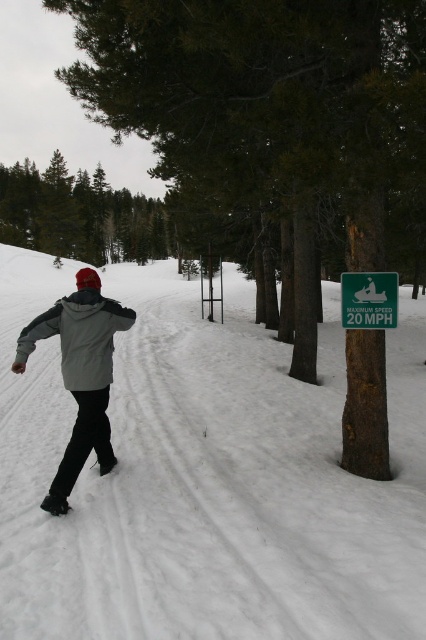
Does green matte tree at upper center have a lesser height compared to gray matte jacket at center?

In fact, green matte tree at upper center may be taller than gray matte jacket at center.

Can you confirm if green matte tree at upper center is positioned above gray matte jacket at center?

Correct, green matte tree at upper center is located above gray matte jacket at center.

Does point (43, 224) lie behind point (54, 316)?

Yes, it is behind point (54, 316).

You are a GUI agent. You are given a task and a screenshot of the screen. Output one action in this format:
    pyautogui.click(x=<x>, y=<y>)
    Task: Click on the green matte tree at upper center
    This screenshot has width=426, height=640.
    Given the screenshot: What is the action you would take?
    pyautogui.click(x=78, y=214)

Can you confirm if green matte tree at upper center is taller than gray fleece jacket at center?

Indeed, green matte tree at upper center has a greater height compared to gray fleece jacket at center.

Can you confirm if green matte tree at upper center is positioned to the left of gray fleece jacket at center?

Indeed, green matte tree at upper center is positioned on the left side of gray fleece jacket at center.

Does point (138, 204) lie behind point (95, 333)?

That is True.

What are the coordinates of `green matte tree at upper center` in the screenshot? It's located at (78, 214).

Describe the element at coordinates (206, 477) in the screenshot. I see `white powdery snow at center` at that location.

Can you confirm if white powdery snow at center is taller than green matte tree at upper center?

In fact, white powdery snow at center may be shorter than green matte tree at upper center.

Is point (181, 298) positioned behind point (103, 180)?

No, (181, 298) is in front of (103, 180).

This screenshot has width=426, height=640. I want to click on white powdery snow at center, so click(206, 477).